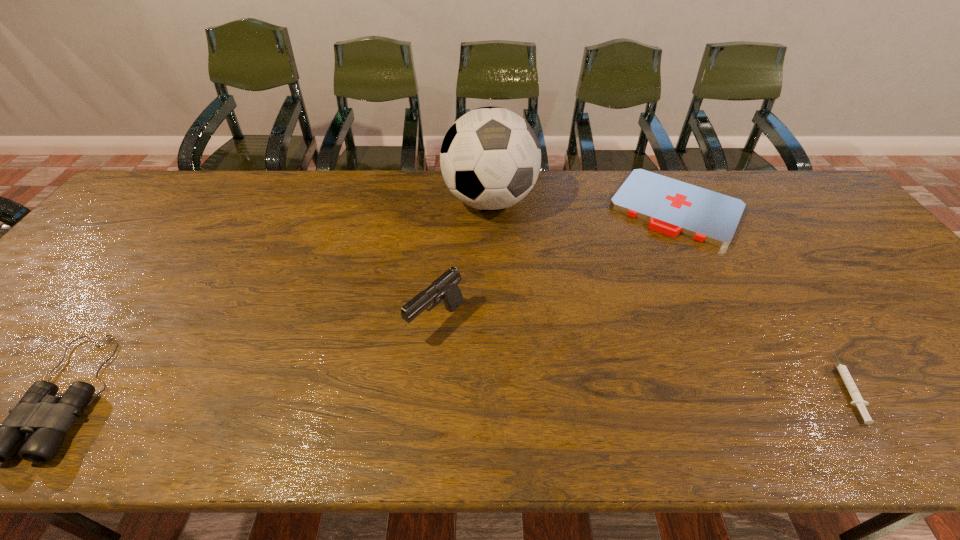
In the image, there is a desktop. Identify the location of free space at the far left corner. The width and height of the screenshot is (960, 540). (191, 186).

Find the location of a particular element. vacant space at the far right corner of the desktop is located at coordinates (834, 208).

Identify the location of free space that is in between the first-aid kit and the syringe. (760, 296).

What are the coordinates of `empty space that is in between the syringe and the pistol` in the screenshot? It's located at (640, 354).

Image resolution: width=960 pixels, height=540 pixels. I want to click on blank region between the syringe and the second tallest object, so click(640, 354).

I want to click on unoccupied area between the first-aid kit and the tallest object, so click(583, 204).

Find the location of `free spot between the first-aid kit and the second tallest object`. free spot between the first-aid kit and the second tallest object is located at coordinates (556, 264).

You are a GUI agent. You are given a task and a screenshot of the screen. Output one action in this format:
    pyautogui.click(x=<x>, y=<y>)
    Task: Click on the empty space that is in between the syringe and the first-aid kit
    
    Given the screenshot: What is the action you would take?
    click(760, 296)

Identify which object is located as the fourth nearest to the leftmost object. Please provide its 2D coordinates. Your answer should be formatted as a tuple, i.e. [(x, y)], where the tuple contains the x and y coordinates of a point satisfying the conditions above.

[(858, 401)]

At what (x,y) coordinates should I click in order to perform the action: click on object identified as the second closest to the pistol. Please return your answer as a coordinate pair (x, y). Looking at the image, I should click on (671, 207).